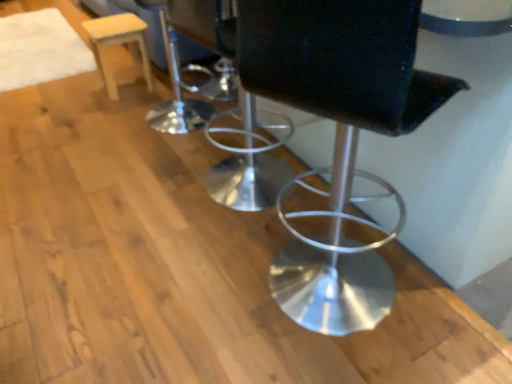
Question: Based on their positions, is metallic silver stool at center located to the left or right of light wood stool at upper left?

Choices:
 (A) right
 (B) left

Answer: (A)

Question: Is metallic silver stool at center wider or thinner than light wood stool at upper left?

Choices:
 (A) wide
 (B) thin

Answer: (A)

Question: From the image's perspective, is metallic silver stool at center positioned above or below light wood stool at upper left?

Choices:
 (A) above
 (B) below

Answer: (B)

Question: In the image, is light wood stool at upper left positioned in front of or behind metallic silver stool at center?

Choices:
 (A) behind
 (B) front

Answer: (A)

Question: Is light wood stool at upper left taller or shorter than metallic silver stool at center?

Choices:
 (A) tall
 (B) short

Answer: (B)

Question: Choose the correct answer: Is light wood stool at upper left inside metallic silver stool at center or outside it?

Choices:
 (A) inside
 (B) outside

Answer: (B)

Question: Is point (117, 31) positioned closer to the camera than point (425, 109)?

Choices:
 (A) farther
 (B) closer

Answer: (A)